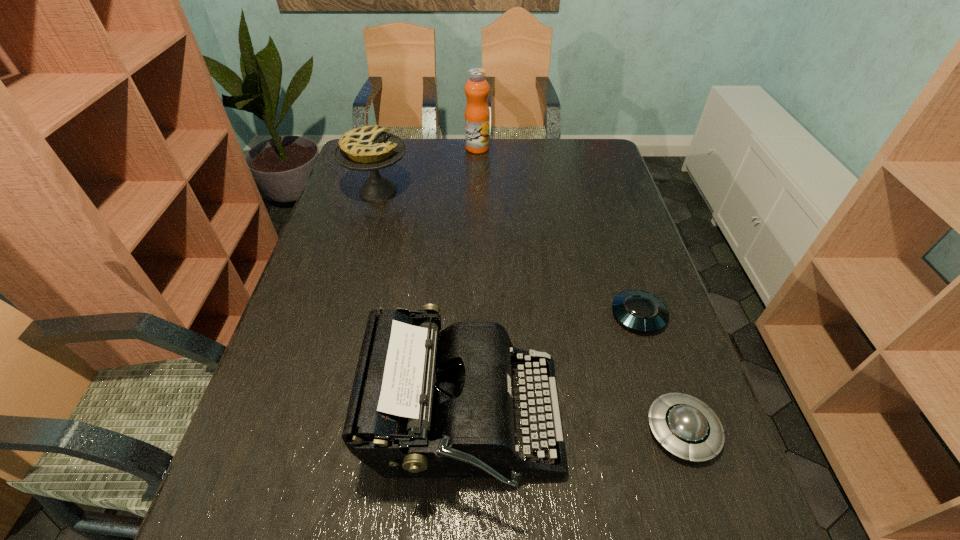
Where is `free space located on the cut side of the pie`? This screenshot has width=960, height=540. free space located on the cut side of the pie is located at coordinates (479, 191).

This screenshot has width=960, height=540. In order to click on blank area located on the typing side of the typewriter in this screenshot , I will do `click(648, 422)`.

Where is `vacant space located on the back of the second shortest object`? This screenshot has height=540, width=960. vacant space located on the back of the second shortest object is located at coordinates (661, 369).

Where is `vacant space located on the front of the farther saucer`? vacant space located on the front of the farther saucer is located at coordinates (653, 362).

I want to click on fruit juice at the far edge, so click(477, 114).

Find the location of a particular element. The width and height of the screenshot is (960, 540). pie positioned at the far edge is located at coordinates (369, 148).

Identify the location of object present at the left edge. (369, 148).

Locate an element on the screen. object that is at the far left corner is located at coordinates (369, 148).

Find the location of a particular element. free space at the far edge of the desktop is located at coordinates (450, 148).

This screenshot has width=960, height=540. In the image, there is a desktop. Find the location of `free space at the near edge`. free space at the near edge is located at coordinates (632, 535).